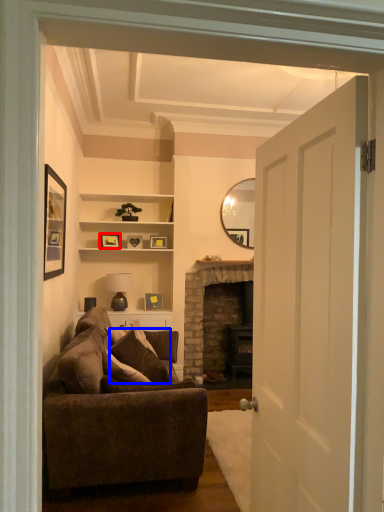
Question: Which object appears closest to the camera in this image, picture frame (highlighted by a red box) or pillow (highlighted by a blue box)?

Choices:
 (A) picture frame
 (B) pillow

Answer: (B)